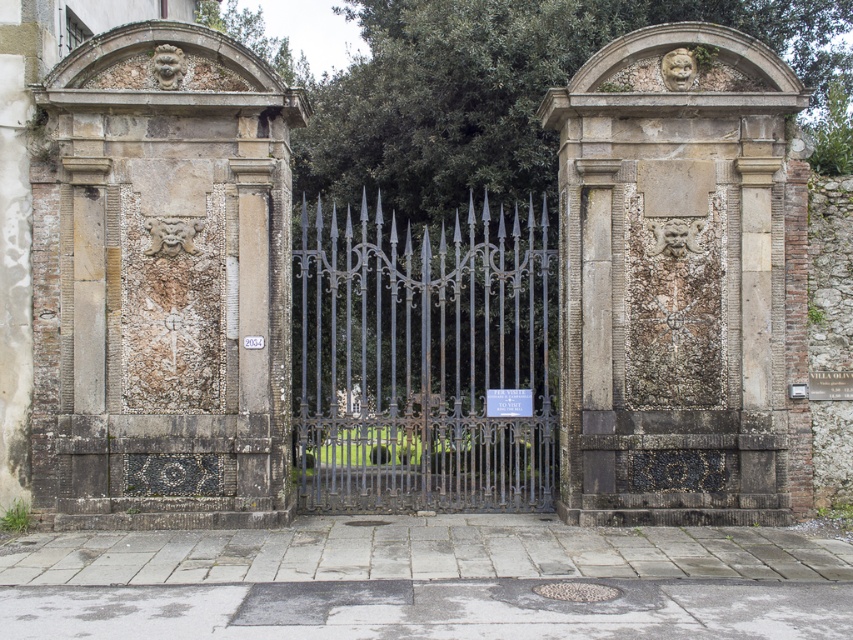
Is the position of stone mosaic wall at left less distant than that of stone textured face at center?

Yes, stone mosaic wall at left is closer to the viewer.

What do you see at coordinates (163, 284) in the screenshot?
I see `stone mosaic wall at left` at bounding box center [163, 284].

Locate an element on the screen. The image size is (853, 640). stone mosaic wall at left is located at coordinates (163, 284).

From the picture: Between stone mosaic wall at left and black wrought iron gate at center, which one appears on the right side from the viewer's perspective?

black wrought iron gate at center

Between stone mosaic wall at left and black wrought iron gate at center, which one has more height?

With more height is stone mosaic wall at left.

What do you see at coordinates (163, 284) in the screenshot? The height and width of the screenshot is (640, 853). I see `stone mosaic wall at left` at bounding box center [163, 284].

This screenshot has height=640, width=853. Find the location of `stone mosaic wall at left`. stone mosaic wall at left is located at coordinates (163, 284).

Does stone textured face at center have a lesser height compared to black wrought iron gate at center?

No.

Can you confirm if stone textured face at center is positioned to the left of black wrought iron gate at center?

Incorrect, stone textured face at center is not on the left side of black wrought iron gate at center.

Measure the distance between point (709,372) and camera.

Point (709,372) and camera are 33.42 feet apart from each other.

Identify the location of stone textured face at center. (677, 282).